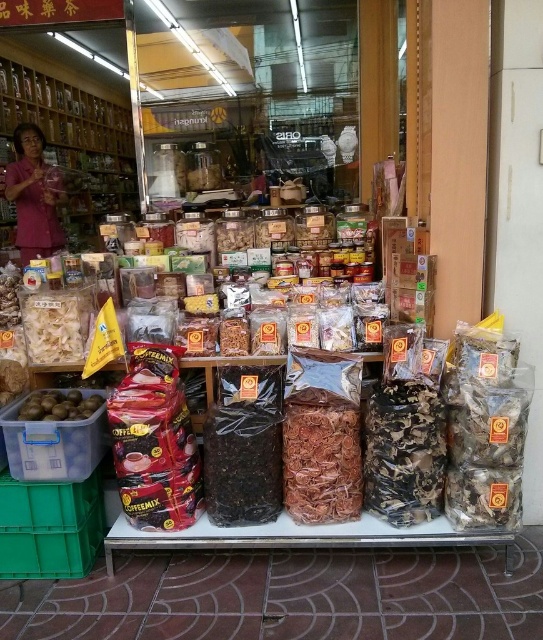
Is point (59, 241) in front of point (36, 417)?

No.

Who is more distant from viewer, (48, 250) or (34, 403)?

Point (48, 250)

Which is in front, point (41, 138) or point (53, 413)?

Positioned in front is point (53, 413).

I want to click on pink fabric at left, so click(x=33, y=196).